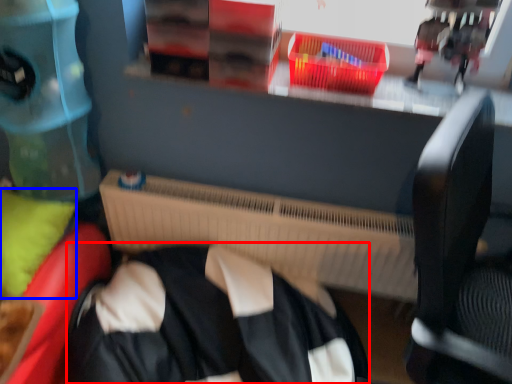
Question: Among these objects, which one is nearest to the camera, clothing (highlighted by a red box) or pillow (highlighted by a blue box)?

Choices:
 (A) clothing
 (B) pillow

Answer: (A)